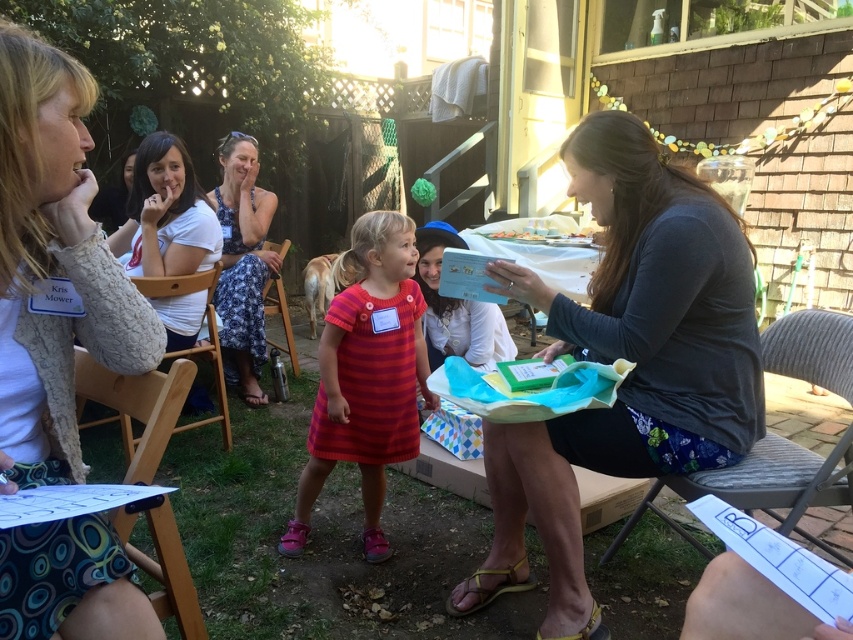
Does wooden chair at center appear under metallic silver chair at center?

Correct, wooden chair at center is located below metallic silver chair at center.

Is wooden chair at center taller than metallic silver chair at center?

Incorrect, wooden chair at center's height is not larger of metallic silver chair at center's.

Which is behind, point (154, 284) or point (271, 244)?

Point (271, 244)

Where is `wooden chair at center`? wooden chair at center is located at coordinates (195, 344).

Is point (393, 385) positioned after point (782, 525)?

Yes, it is behind point (782, 525).

Which of these two, striped cotton dress at center or gray fabric chair at lower right, stands shorter?

Standing shorter between the two is gray fabric chair at lower right.

I want to click on striped cotton dress at center, so click(x=366, y=374).

Which of these two, wooden chair at center or smooth plastic plate at center, stands taller?

Standing taller between the two is wooden chair at center.

Locate an element on the screen. wooden chair at center is located at coordinates (195, 344).

You are a GUI agent. You are given a task and a screenshot of the screen. Output one action in this format:
    pyautogui.click(x=<x>, y=<y>)
    Task: Click on the wooden chair at center
    This screenshot has height=640, width=853.
    Given the screenshot: What is the action you would take?
    pyautogui.click(x=195, y=344)